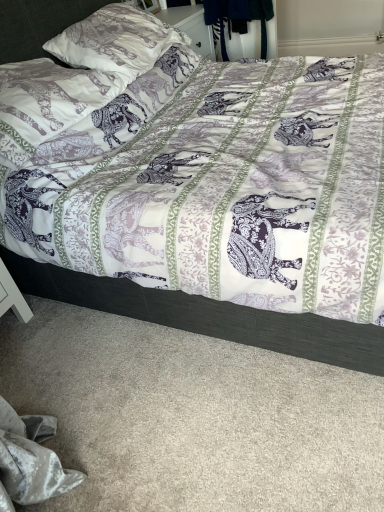
Question: Is matte white pillow at upper left, which is counted as the 2th pillow, starting from the bottom, behind printed fabric pillow at upper left, which is the 2th pillow in top-to-bottom order?

Choices:
 (A) yes
 (B) no

Answer: (A)

Question: From the image's perspective, does matte white pillow at upper left, placed as the 1th pillow when sorted from top to bottom, appear higher than printed fabric pillow at upper left, which is the 2th pillow in top-to-bottom order?

Choices:
 (A) yes
 (B) no

Answer: (A)

Question: From a real-world perspective, is matte white pillow at upper left, which is counted as the 2th pillow, starting from the bottom, positioned over printed fabric pillow at upper left, which is the 2th pillow in top-to-bottom order, based on gravity?

Choices:
 (A) no
 (B) yes

Answer: (B)

Question: Is matte white pillow at upper left, which is counted as the 2th pillow, starting from the bottom, taller than printed fabric pillow at upper left, placed as the first pillow when sorted from bottom to top?

Choices:
 (A) yes
 (B) no

Answer: (A)

Question: From the image's perspective, does matte white pillow at upper left, placed as the 1th pillow when sorted from top to bottom, appear lower than printed fabric pillow at upper left, placed as the first pillow when sorted from bottom to top?

Choices:
 (A) no
 (B) yes

Answer: (A)

Question: Considering the positions of printed fabric pillow at upper left, which is the 2th pillow in top-to-bottom order, and matte white pillow at upper left, placed as the 1th pillow when sorted from top to bottom, in the image, is printed fabric pillow at upper left, which is the 2th pillow in top-to-bottom order, taller or shorter than matte white pillow at upper left, placed as the 1th pillow when sorted from top to bottom,?

Choices:
 (A) tall
 (B) short

Answer: (B)

Question: Considering their positions, is printed fabric pillow at upper left, placed as the first pillow when sorted from bottom to top, located in front of or behind matte white pillow at upper left, which is counted as the 2th pillow, starting from the bottom?

Choices:
 (A) behind
 (B) front

Answer: (B)

Question: From a real-world perspective, is printed fabric pillow at upper left, placed as the first pillow when sorted from bottom to top, above or below matte white pillow at upper left, placed as the 1th pillow when sorted from top to bottom?

Choices:
 (A) below
 (B) above

Answer: (A)

Question: In terms of size, does printed fabric pillow at upper left, which is the 2th pillow in top-to-bottom order, appear bigger or smaller than matte white pillow at upper left, placed as the 1th pillow when sorted from top to bottom?

Choices:
 (A) big
 (B) small

Answer: (B)

Question: Considering the positions of point (24, 133) and point (64, 269), is point (24, 133) closer or farther from the camera than point (64, 269)?

Choices:
 (A) closer
 (B) farther

Answer: (A)

Question: Considering the positions of printed fabric pillow at upper left, which is the 2th pillow in top-to-bottom order, and purple printed fabric bed at center in the image, is printed fabric pillow at upper left, which is the 2th pillow in top-to-bottom order, bigger or smaller than purple printed fabric bed at center?

Choices:
 (A) big
 (B) small

Answer: (B)

Question: Considering the positions of printed fabric pillow at upper left, which is the 2th pillow in top-to-bottom order, and purple printed fabric bed at center in the image, is printed fabric pillow at upper left, which is the 2th pillow in top-to-bottom order, wider or thinner than purple printed fabric bed at center?

Choices:
 (A) thin
 (B) wide

Answer: (A)

Question: Is printed fabric pillow at upper left, which is the 2th pillow in top-to-bottom order, to the left or to the right of purple printed fabric bed at center in the image?

Choices:
 (A) left
 (B) right

Answer: (A)

Question: Is point (132, 58) closer or farther from the camera than point (18, 80)?

Choices:
 (A) closer
 (B) farther

Answer: (B)

Question: Looking at their shapes, would you say matte white pillow at upper left, placed as the 1th pillow when sorted from top to bottom, is wider or thinner than printed fabric pillow at upper left, which is the 2th pillow in top-to-bottom order?

Choices:
 (A) wide
 (B) thin

Answer: (A)